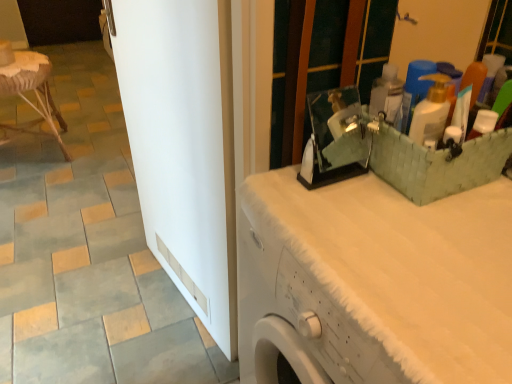
The image size is (512, 384). Describe the element at coordinates (34, 92) in the screenshot. I see `rattan stool at left` at that location.

This screenshot has width=512, height=384. What do you see at coordinates (381, 277) in the screenshot?
I see `white textured counter top at upper right` at bounding box center [381, 277].

I want to click on gray matte tile at lower left, so click(65, 356).

Is white glossy door at center facing towards white textured counter top at upper right?

No, white glossy door at center is not aimed at white textured counter top at upper right.

Looking at the image, does white glossy door at center seem bigger or smaller compared to white textured counter top at upper right?

Clearly, white glossy door at center is smaller in size than white textured counter top at upper right.

Between white glossy door at center and white textured counter top at upper right, which one has smaller width?

white glossy door at center is thinner.

Considering the points (97, 344) and (286, 276), which point is in front, point (97, 344) or point (286, 276)?

The point (286, 276) is in front.

From a real-world perspective, who is located lower, gray matte tile at lower left or white textured counter top at upper right?

In real-world perspective, gray matte tile at lower left is lower.

Is gray matte tile at lower left wider or thinner than white textured counter top at upper right?

Clearly, gray matte tile at lower left has less width compared to white textured counter top at upper right.

From the picture: Does gray matte tile at lower left turn towards white textured counter top at upper right?

No.

From a real-world perspective, which object stands above the other?

white glossy door at center, from a real-world perspective.

In the scene shown: Is gray matte tile at lower left far away from white glossy door at center?

gray matte tile at lower left is near white glossy door at center, not far away.

From the image's perspective, would you say gray matte tile at lower left is shown under white glossy door at center?

Correct, gray matte tile at lower left appears lower than white glossy door at center in the image.

From the image's perspective, which is above, white textured counter top at upper right or rattan stool at left?

From the image's view, rattan stool at left is above.

Is white textured counter top at upper right with rattan stool at left?

They are not placed beside each other.

Is white textured counter top at upper right surrounding rattan stool at left?

No, white textured counter top at upper right does not contain rattan stool at left.

Which object is positioned more to the left, white glossy door at center or gray matte tile at lower left?

gray matte tile at lower left.

In terms of width, does white glossy door at center look wider or thinner when compared to gray matte tile at lower left?

Clearly, white glossy door at center has less width compared to gray matte tile at lower left.

Which of these two, white glossy door at center or gray matte tile at lower left, is smaller?

Smaller between the two is gray matte tile at lower left.

Could you tell me if white glossy door at center is turned towards gray matte tile at lower left?

Yes.

Which point is more forward, (x=201, y=258) or (x=47, y=96)?

Positioned in front is point (x=201, y=258).

Does white glossy door at center have a lesser width compared to rattan stool at left?

Correct, the width of white glossy door at center is less than that of rattan stool at left.

This screenshot has width=512, height=384. Find the location of `furniture behind the white glossy door at center`. furniture behind the white glossy door at center is located at coordinates (34, 92).

Is rattan stool at left at the back of white glossy door at center?

No.

In terms of height, does white textured counter top at upper right look taller or shorter compared to gray matte tile at lower left?

Considering their sizes, white textured counter top at upper right has more height than gray matte tile at lower left.

Is white textured counter top at upper right completely or partially outside of gray matte tile at lower left?

white textured counter top at upper right lies outside gray matte tile at lower left's area.

How far apart are white textured counter top at upper right and gray matte tile at lower left?

The distance of white textured counter top at upper right from gray matte tile at lower left is 38.70 inches.

Which object is positioned more to the left, white textured counter top at upper right or gray matte tile at lower left?

Positioned to the left is gray matte tile at lower left.

I want to click on screen door to the left of white textured counter top at upper right, so (183, 144).

Locate an element on the screen. The width and height of the screenshot is (512, 384). counter top that is above the gray matte tile at lower left (from the image's perspective) is located at coordinates (381, 277).

Based on their spatial positions, is rattan stool at left or white textured counter top at upper right further from white glossy door at center?

Based on the image, rattan stool at left appears to be further to white glossy door at center.

Considering their positions, is gray matte tile at lower left positioned closer to white glossy door at center than white textured counter top at upper right?

white textured counter top at upper right lies closer to white glossy door at center than the other object.

From the picture: Based on their spatial positions, is rattan stool at left or white glossy door at center closer to gray matte tile at lower left?

white glossy door at center.

Estimate the real-world distances between objects in this image. Which object is closer to gray matte tile at lower left, white textured counter top at upper right or rattan stool at left?

Among the two, white textured counter top at upper right is located nearer to gray matte tile at lower left.

Consider the image. When comparing their distances from white textured counter top at upper right, does rattan stool at left or gray matte tile at lower left seem closer?

Among the two, gray matte tile at lower left is located nearer to white textured counter top at upper right.

Considering their positions, is gray matte tile at lower left positioned closer to rattan stool at left than white textured counter top at upper right?

gray matte tile at lower left is closer to rattan stool at left.

Looking at the image, which one is located further to white textured counter top at upper right, rattan stool at left or white glossy door at center?

rattan stool at left is further to white textured counter top at upper right.

From the picture: When comparing their distances from gray matte tile at lower left, does rattan stool at left or white textured counter top at upper right seem further?

rattan stool at left is positioned further to the anchor gray matte tile at lower left.

Find the location of a particular element. The height and width of the screenshot is (384, 512). screen door located between white textured counter top at upper right and rattan stool at left in the depth direction is located at coordinates (183, 144).

Locate an element on the screen. The width and height of the screenshot is (512, 384). ceramic tile located between white glossy door at center and rattan stool at left in the depth direction is located at coordinates (65, 356).

This screenshot has height=384, width=512. What are the coordinates of `ceramic tile located between rattan stool at left and white textured counter top at upper right in the left-right direction` in the screenshot? It's located at (65, 356).

The width and height of the screenshot is (512, 384). I want to click on screen door between gray matte tile at lower left and white textured counter top at upper right from left to right, so click(x=183, y=144).